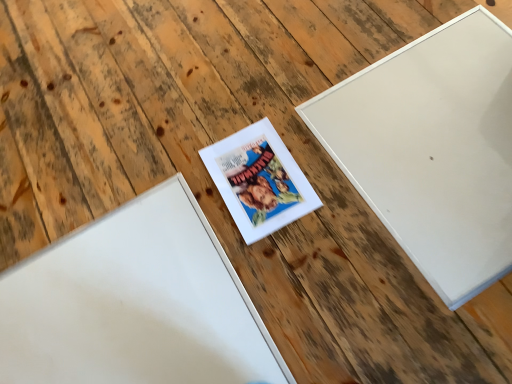
The image size is (512, 384). In order to click on spots to the right of white matte picture frame at center, the 3th picture frame in the right-to-left sequence in this screenshot , I will do `click(325, 230)`.